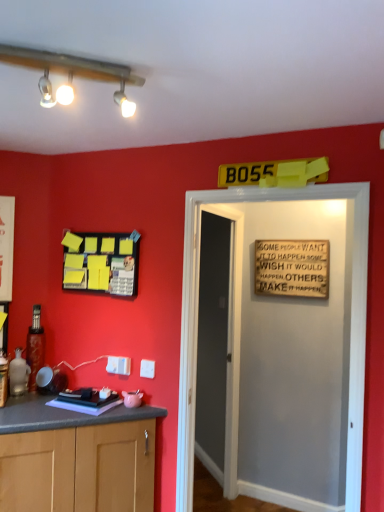
You are a GUI agent. You are given a task and a screenshot of the screen. Output one action in this format:
    pyautogui.click(x=<x>, y=<y>)
    Task: Click on the free point above yellow matte bulletin board at upper left (from a real-world perspective)
    The height and width of the screenshot is (512, 384).
    Given the screenshot: What is the action you would take?
    coord(114,224)